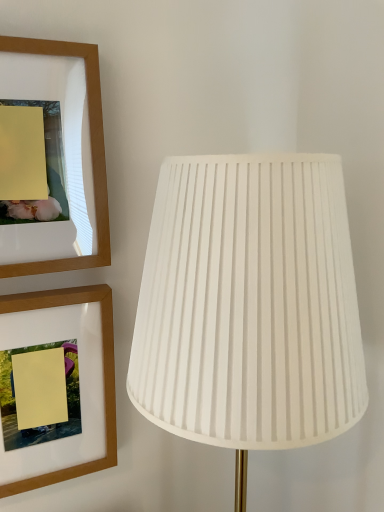
Question: Is wooden picture frame at upper left, which is the second picture frame from top to bottom, turned away from white pleated fabric lamp at right?

Choices:
 (A) no
 (B) yes

Answer: (A)

Question: Is white pleated fabric lamp at right surrounded by wooden picture frame at upper left, which is the first picture frame in bottom-to-top order?

Choices:
 (A) yes
 (B) no

Answer: (B)

Question: Is wooden picture frame at upper left, which is the second picture frame from top to bottom, shorter than white pleated fabric lamp at right?

Choices:
 (A) no
 (B) yes

Answer: (B)

Question: Is wooden picture frame at upper left, which is the second picture frame from top to bottom, taller than white pleated fabric lamp at right?

Choices:
 (A) yes
 (B) no

Answer: (B)

Question: Does wooden picture frame at upper left, which is the second picture frame from top to bottom, appear on the left side of white pleated fabric lamp at right?

Choices:
 (A) yes
 (B) no

Answer: (A)

Question: Can you confirm if wooden picture frame at upper left, which is the second picture frame from top to bottom, is thinner than white pleated fabric lamp at right?

Choices:
 (A) no
 (B) yes

Answer: (B)

Question: Is wooden picture frame at upper left, the 2th picture frame positioned from the bottom, taller than wooden picture frame at upper left, which is the first picture frame in bottom-to-top order?

Choices:
 (A) yes
 (B) no

Answer: (B)

Question: Is wooden picture frame at upper left, positioned as the first picture frame in top-to-bottom order, to the right of wooden picture frame at upper left, which is the first picture frame in bottom-to-top order, from the viewer's perspective?

Choices:
 (A) no
 (B) yes

Answer: (A)

Question: From the image's perspective, is wooden picture frame at upper left, positioned as the first picture frame in top-to-bottom order, under wooden picture frame at upper left, which is the second picture frame from top to bottom?

Choices:
 (A) no
 (B) yes

Answer: (A)

Question: Is wooden picture frame at upper left, positioned as the first picture frame in top-to-bottom order, positioned with its back to wooden picture frame at upper left, which is the first picture frame in bottom-to-top order?

Choices:
 (A) no
 (B) yes

Answer: (A)

Question: Considering the relative sizes of wooden picture frame at upper left, positioned as the first picture frame in top-to-bottom order, and wooden picture frame at upper left, which is the first picture frame in bottom-to-top order, in the image provided, is wooden picture frame at upper left, positioned as the first picture frame in top-to-bottom order, shorter than wooden picture frame at upper left, which is the first picture frame in bottom-to-top order,?

Choices:
 (A) no
 (B) yes

Answer: (B)

Question: Is wooden picture frame at upper left, the 2th picture frame positioned from the bottom, bigger than wooden picture frame at upper left, which is the second picture frame from top to bottom?

Choices:
 (A) yes
 (B) no

Answer: (B)

Question: Does wooden picture frame at upper left, the 2th picture frame positioned from the bottom, lie in front of white pleated fabric lamp at right?

Choices:
 (A) no
 (B) yes

Answer: (A)